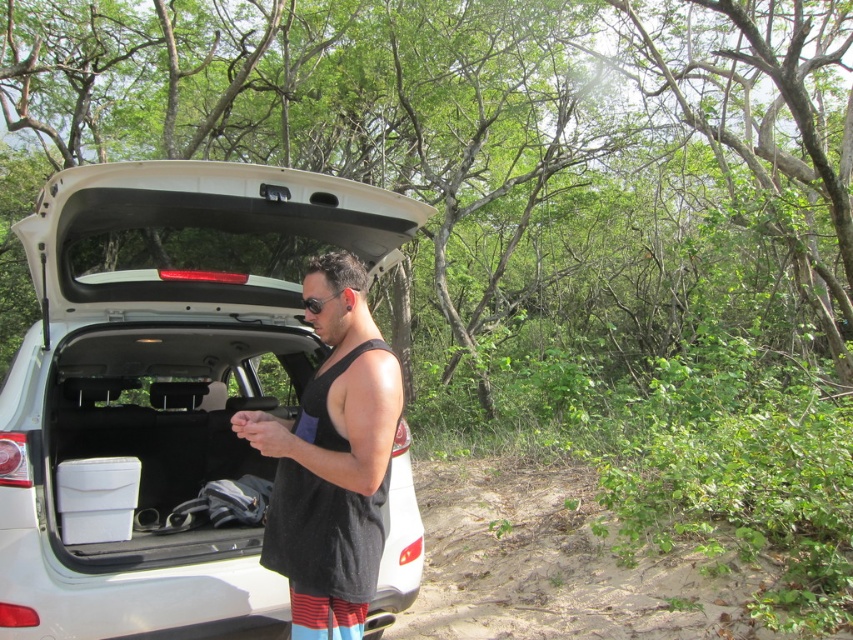
Question: Can you confirm if white matte car trunk at center is positioned to the right of black mesh tank top at center?

Choices:
 (A) no
 (B) yes

Answer: (A)

Question: Which point is closer to the camera?

Choices:
 (A) black mesh tank top at center
 (B) white matte car trunk at center

Answer: (A)

Question: Among these objects, which one is farthest from the camera?

Choices:
 (A) white matte car trunk at center
 (B) black mesh tank top at center

Answer: (A)

Question: Which point is farther to the camera?

Choices:
 (A) black mesh tank top at center
 (B) white matte car trunk at center

Answer: (B)

Question: Is white matte car trunk at center positioned in front of black mesh tank top at center?

Choices:
 (A) yes
 (B) no

Answer: (B)

Question: Is white matte car trunk at center above black mesh tank top at center?

Choices:
 (A) no
 (B) yes

Answer: (A)